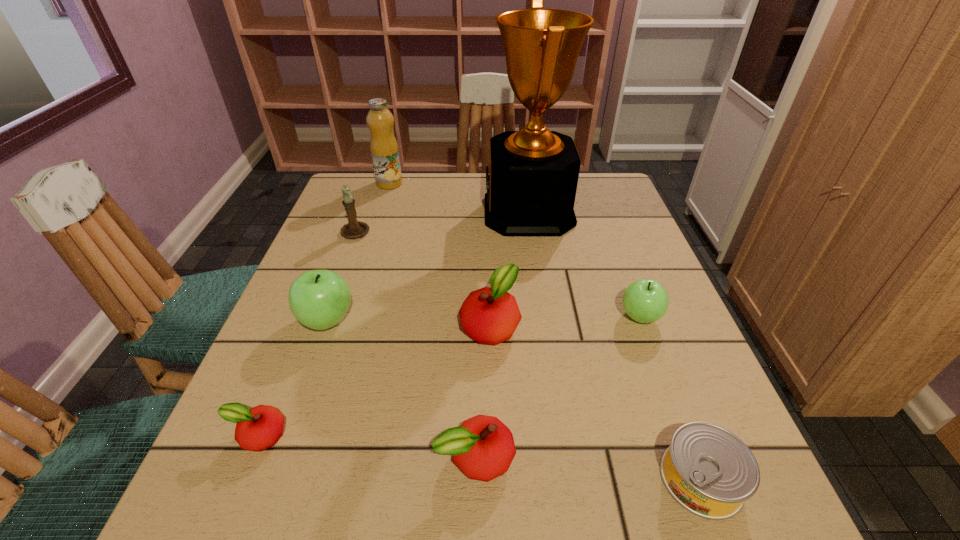
Locate an element on the screen. The width and height of the screenshot is (960, 540). fruit juice that is at the left edge is located at coordinates (384, 149).

You are a GUI agent. You are given a task and a screenshot of the screen. Output one action in this format:
    pyautogui.click(x=<x>, y=<y>)
    Task: Click on the candle holder that is at the left edge
    
    Given the screenshot: What is the action you would take?
    pyautogui.click(x=354, y=229)

Where is `trophy cup present at the right edge`? This screenshot has height=540, width=960. trophy cup present at the right edge is located at coordinates (531, 181).

What are the coordinates of `apple located at the right edge` in the screenshot? It's located at (646, 300).

I want to click on can at the right edge, so click(x=708, y=470).

Locate an element on the screen. object that is positioned at the far left corner is located at coordinates (384, 149).

At what (x,y) coordinates should I click in order to perform the action: click on object positioned at the far right corner. Please return your answer as a coordinate pair (x, y). The image size is (960, 540). Looking at the image, I should click on (531, 181).

Where is `object situated at the near right corner`? object situated at the near right corner is located at coordinates pos(708,470).

Where is `vacant space at the far edge`? This screenshot has height=540, width=960. vacant space at the far edge is located at coordinates (480, 215).

In the image, there is a desktop. Identify the location of vacant space at the near edge. This screenshot has width=960, height=540. (613, 509).